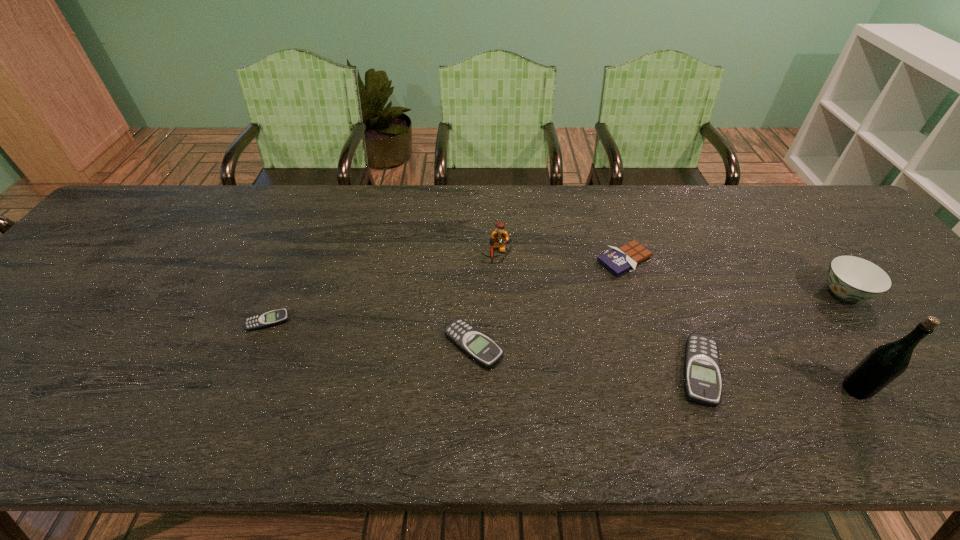
The image size is (960, 540). What are the coordinates of `free space located 0.270m on the right of the shortest object` in the screenshot? It's located at point(402,321).

Identify the location of free space located on the left of the second shortest beeper. (373, 346).

At what (x,y) coordinates should I click in order to perform the action: click on vacant space positioned on the left of the rightmost beeper. Please return your answer as a coordinate pair (x, y). Looking at the image, I should click on (560, 372).

The image size is (960, 540). What are the coordinates of `free space located holding a crossbow in the hands of the Lego` in the screenshot? It's located at (499, 327).

You are a GUI agent. You are given a task and a screenshot of the screen. Output one action in this format:
    pyautogui.click(x=<x>, y=<y>)
    Task: Click on the blank area located on the back of the soup bowl
    
    Given the screenshot: What is the action you would take?
    pyautogui.click(x=794, y=228)

Locate an element on the screen. This screenshot has height=540, width=960. vacant space situated on the left of the chocolate bar is located at coordinates (534, 260).

This screenshot has width=960, height=540. Identify the location of free spot located 0.050m on the left of the second object from right to left. (819, 389).

Locate an element on the screen. beer bottle at the near edge is located at coordinates (881, 366).

At what (x,y) coordinates should I click in order to perform the action: click on object at the right edge. Please return your answer as a coordinate pair (x, y). Image resolution: width=960 pixels, height=540 pixels. Looking at the image, I should click on (850, 278).

Image resolution: width=960 pixels, height=540 pixels. In the image, there is a desktop. In order to click on vacant region at the far edge in this screenshot , I will do `click(587, 232)`.